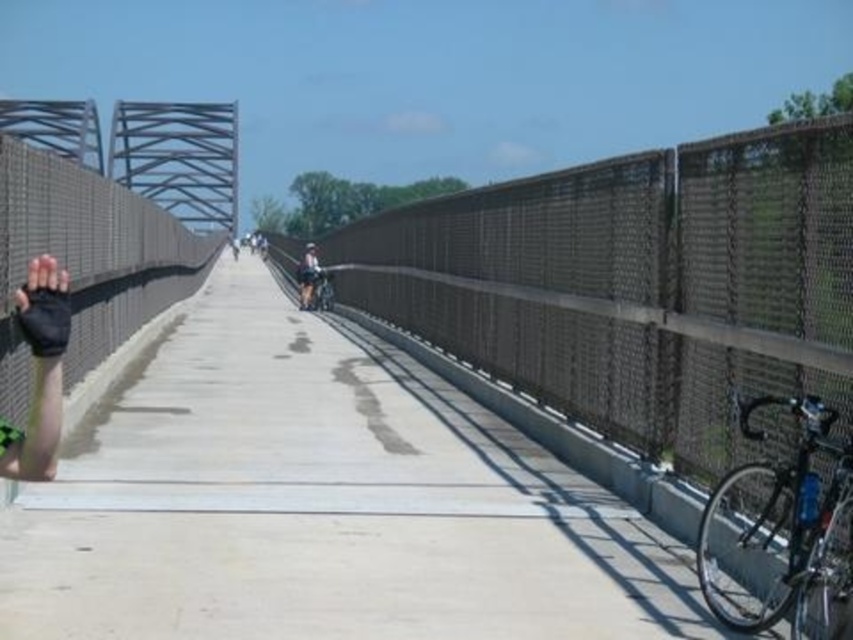
Does concrete at center have a greater width compared to shiny silver bicycle at right?

Correct, the width of concrete at center exceeds that of shiny silver bicycle at right.

Between point (201, 484) and point (758, 621), which one is positioned in front?

Positioned in front is point (758, 621).

Find the location of a particular element. The width and height of the screenshot is (853, 640). concrete at center is located at coordinates (321, 506).

Identify the location of concrete at center. (321, 506).